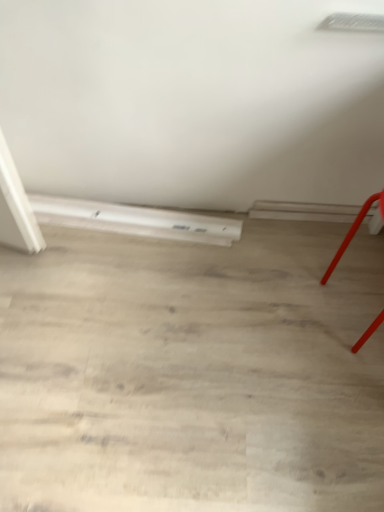
Find the location of `vacant space underneath smooth red chair at right (from a real-world perspective)`. vacant space underneath smooth red chair at right (from a real-world perspective) is located at coordinates click(354, 305).